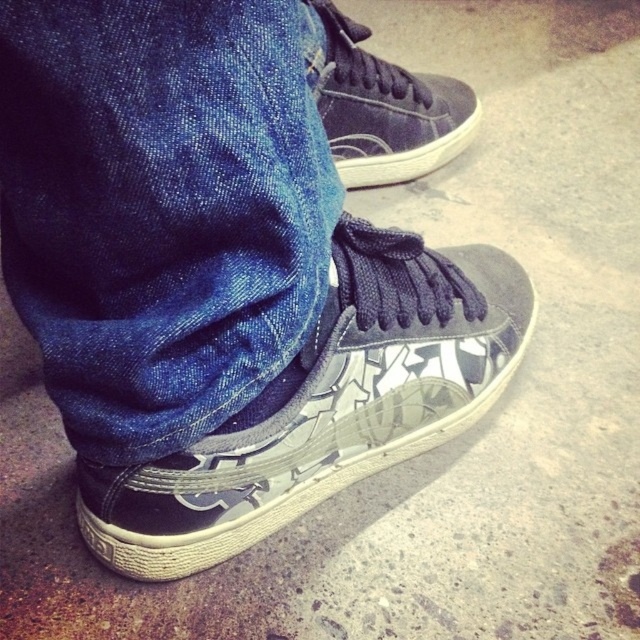
Who is more forward, [60,145] or [332,36]?

Point [60,145] is in front.

This screenshot has width=640, height=640. Identify the location of denim at center. (161, 208).

Is point (360, 365) farther from viewer compared to point (330, 4)?

No, it is in front of (330, 4).

Does glossy leather sneaker at lower center come behind matte black sneaker at center?

That is False.

The height and width of the screenshot is (640, 640). I want to click on glossy leather sneaker at lower center, so click(324, 404).

Between denim at center and glossy leather sneaker at lower center, which one is positioned higher?

denim at center is higher up.

Which is below, denim at center or glossy leather sneaker at lower center?

Positioned lower is glossy leather sneaker at lower center.

Between point (193, 97) and point (490, 396), which one is positioned in front?

Point (193, 97) is more forward.

Where is `denim at center`? denim at center is located at coordinates (161, 208).